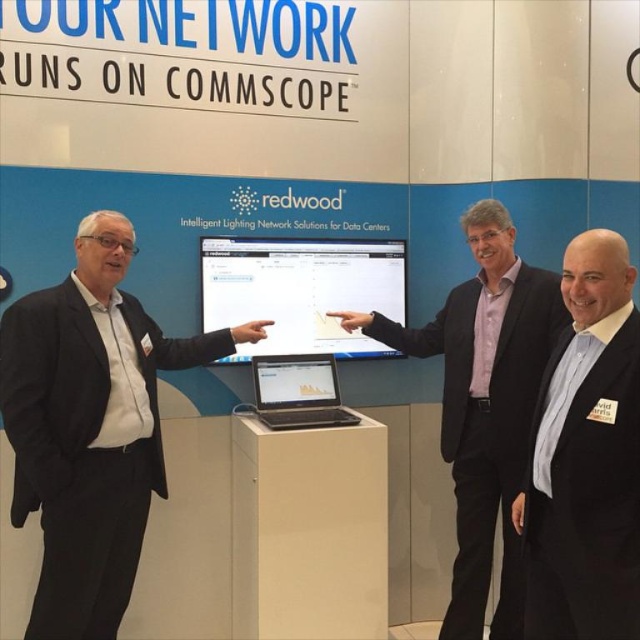
Can you confirm if black suit at left is wider than pink fabric shirt at center?

Incorrect, black suit at left's width does not surpass pink fabric shirt at center's.

Between black suit at left and pink fabric shirt at center, which one appears on the left side from the viewer's perspective?

Positioned to the left is black suit at left.

Which is behind, point (116, 221) or point (460, 552)?

Point (460, 552)

Locate an element on the screen. This screenshot has width=640, height=640. black suit at left is located at coordinates coord(90,426).

Is point (120, 221) positioned behind point (282, 369)?

No, it is not.

Is black suit at left in front of sleek silver laptop at center?

Yes, black suit at left is in front of sleek silver laptop at center.

Where is `black suit at left`? The height and width of the screenshot is (640, 640). black suit at left is located at coordinates (90, 426).

Is point (589, 292) positioned before point (502, 305)?

Yes, it is in front of point (502, 305).

Consider the image. Who is more distant from viewer, (586, 512) or (490, 381)?

The point (490, 381) is behind.

What do you see at coordinates (588, 458) in the screenshot?
I see `black suit at center` at bounding box center [588, 458].

At what (x,y) coordinates should I click in order to perform the action: click on black suit at center. Please return your answer as a coordinate pair (x, y). Looking at the image, I should click on (588, 458).